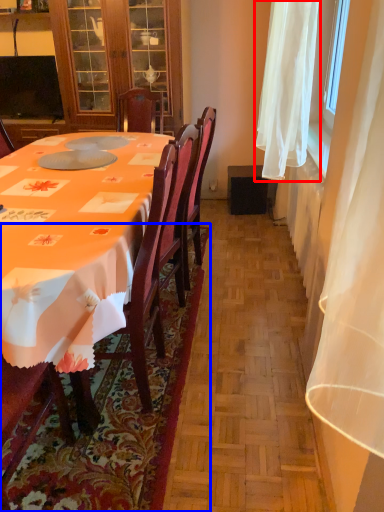
Question: Which of the following is the farthest to the observer, curtain (highlighted by a red box) or mat (highlighted by a blue box)?

Choices:
 (A) curtain
 (B) mat

Answer: (A)